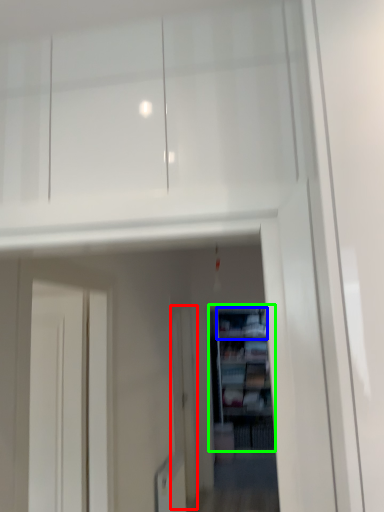
Question: Based on their relative distances, which object is farther from screen door (highlighted by a red box)? Choose from cabinet (highlighted by a blue box) and shelf (highlighted by a green box).

Choices:
 (A) cabinet
 (B) shelf

Answer: (A)